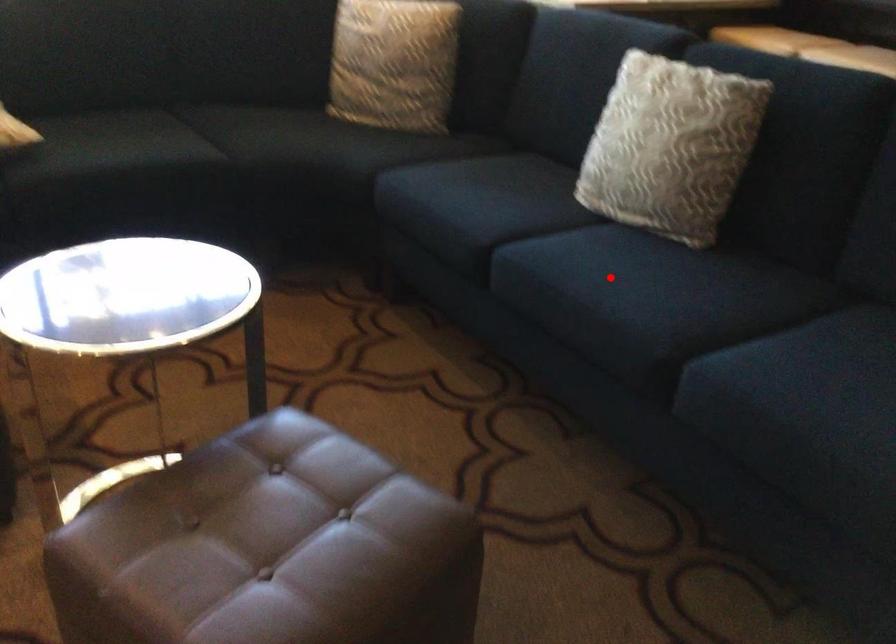
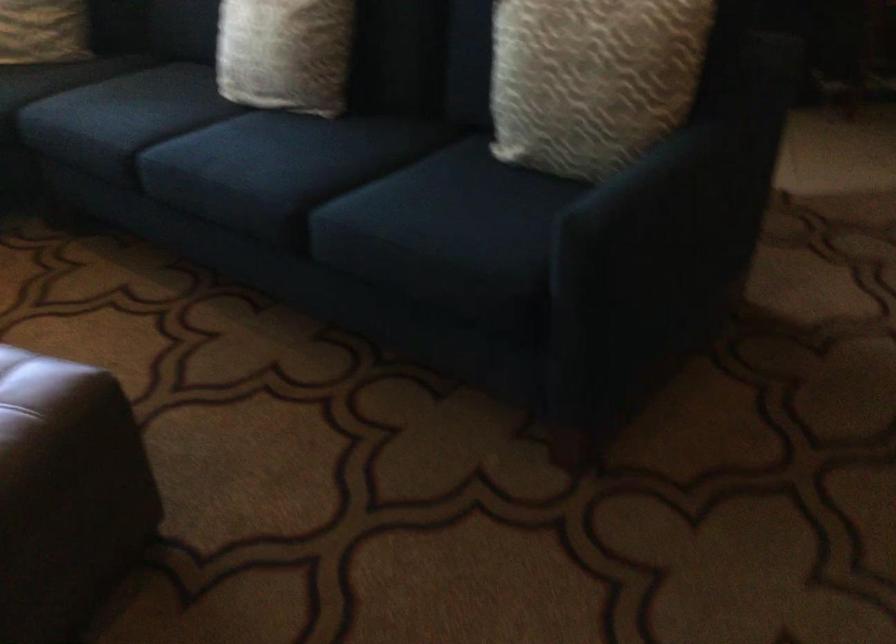
Question: I am providing you with two images of the same scene from different viewpoints. A red point is marked on the first image. Can you still see the location of the red point in image 2?

Choices:
 (A) Yes
 (B) No

Answer: (A)